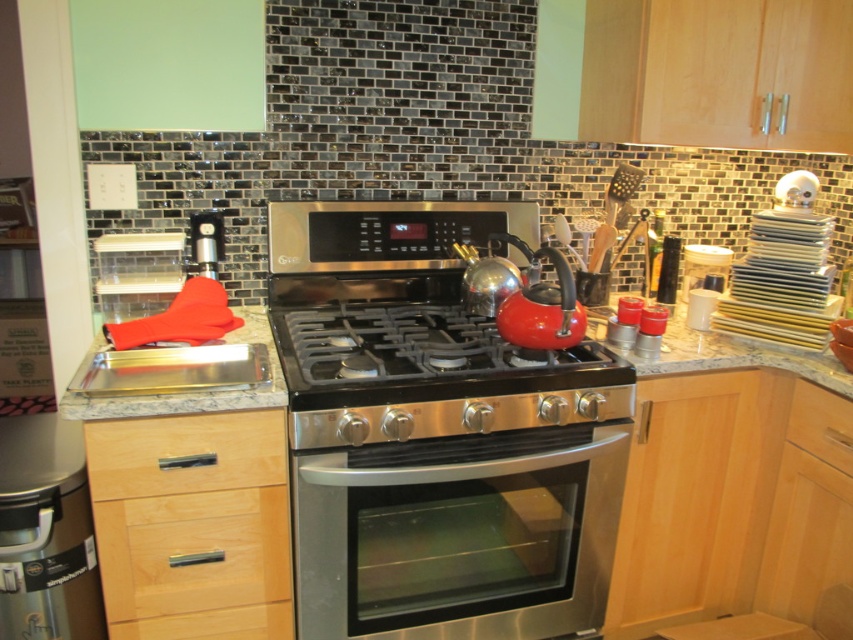
Question: Which point appears closest to the camera in this image?

Choices:
 (A) (128, 420)
 (B) (770, 365)

Answer: (A)

Question: Does stainless steel oven at center have a lesser width compared to light wood/dark finish drawer at lower left?

Choices:
 (A) yes
 (B) no

Answer: (B)

Question: Which of the following is the farthest from the observer?

Choices:
 (A) (438, 320)
 (B) (646, 360)
 (C) (329, 636)

Answer: (A)

Question: Is light wood/wooden drawer at lower left in front of wooden drawer at lower right?

Choices:
 (A) yes
 (B) no

Answer: (A)

Question: Which of the following is the closest to the observer?

Choices:
 (A) stainless steel oven at center
 (B) granite countertop at center
 (C) light wood/wooden drawer at lower left
 (D) wooden drawer at lower right

Answer: (C)

Question: Is light wood/wooden drawer at lower left positioned before wooden drawer at lower right?

Choices:
 (A) yes
 (B) no

Answer: (A)